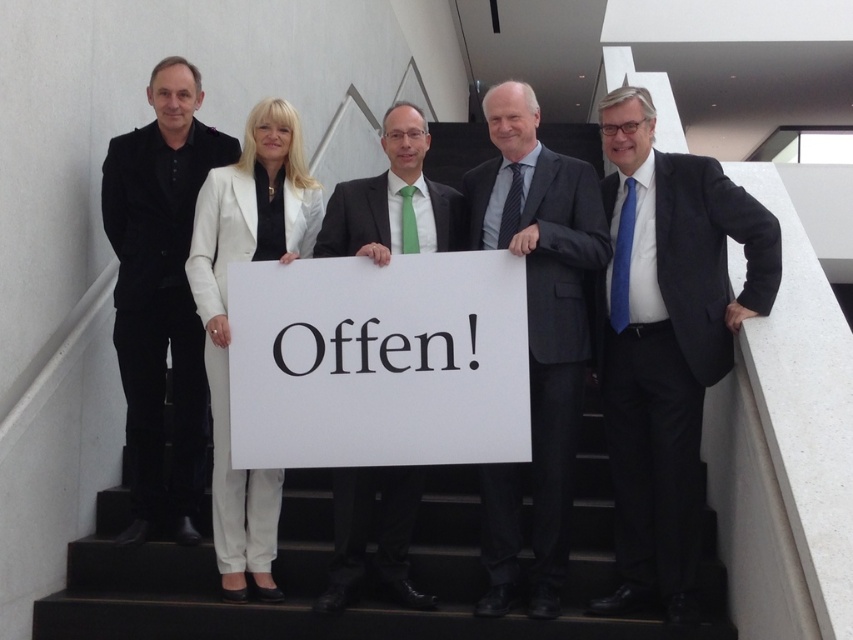
You are a photographer setting up for a group photo. You have two subjects wearing the dark gray suit at center and the white smooth suit at center. You want to ensure there is at least 5 feet of space between them for proper lighting. Based on the scene description, is the current distance sufficient?

The dark gray suit at center is 4.16 feet from the white smooth suit at center, which is less than the required 5 feet. Therefore, the current distance is insufficient for proper lighting.

You are a photographer adjusting the camera settings to ensure everyone is in focus. The dark gray suit at center and the white smooth suit at center are both at the center of the frame. Which one should you adjust the focus for first if you want to ensure the taller one is sharp?

The dark gray suit at center is much taller than the white smooth suit at center, so you should adjust the focus for the dark gray suit at center first to ensure it is sharp.

You are a photographer arranging a group photo. You have two subjects wearing a dark gray suit at center and a white smooth suit at center. Based on their positions, which subject should you adjust to ensure they are aligned symmetrically along the central axis?

The dark gray suit at center is to the right of the white smooth suit at center. To align them symmetrically along the central axis, move the dark gray suit at center to the left until it mirrors the position of the white smooth suit at center relative to the center line.